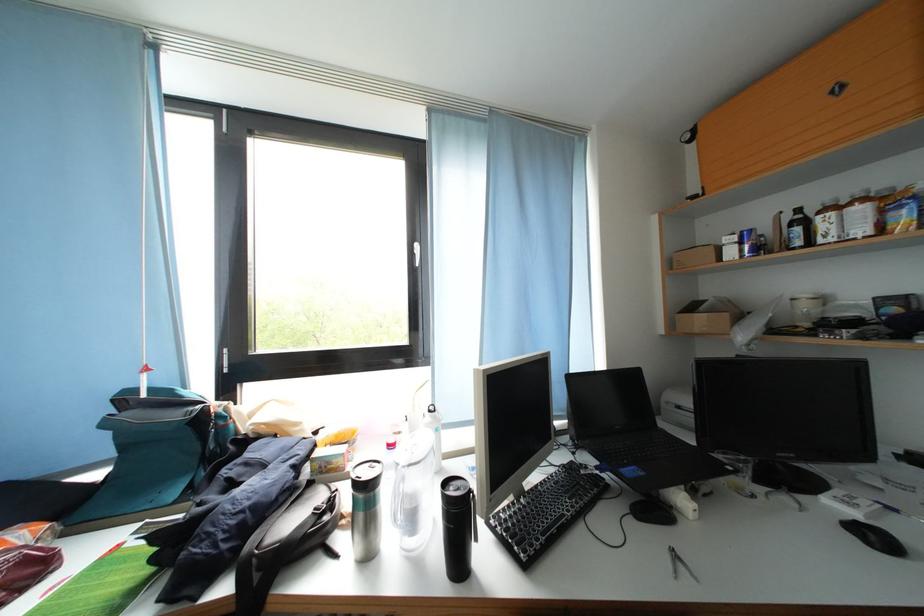
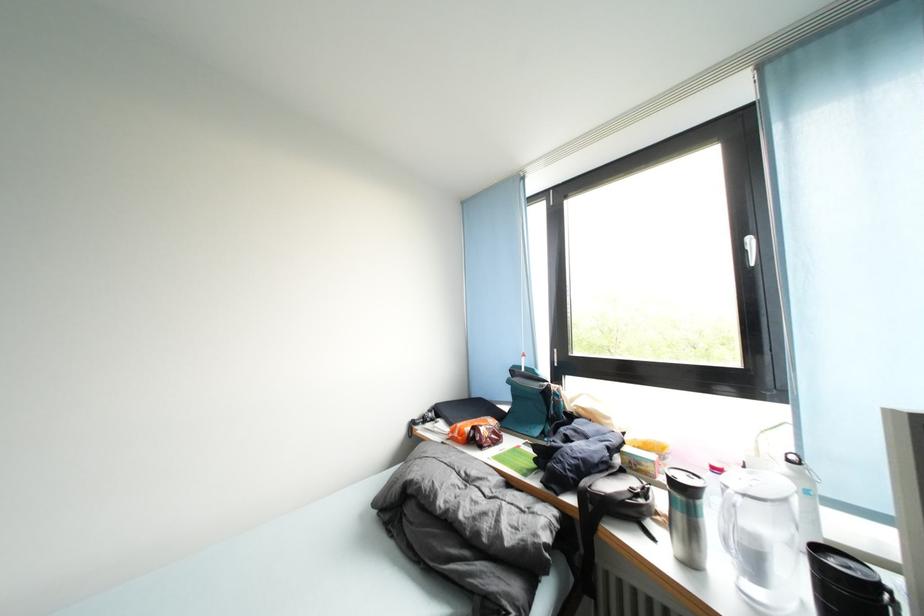
Find the pixel in the second image that matches the point at 398,451 in the first image.

(723, 475)